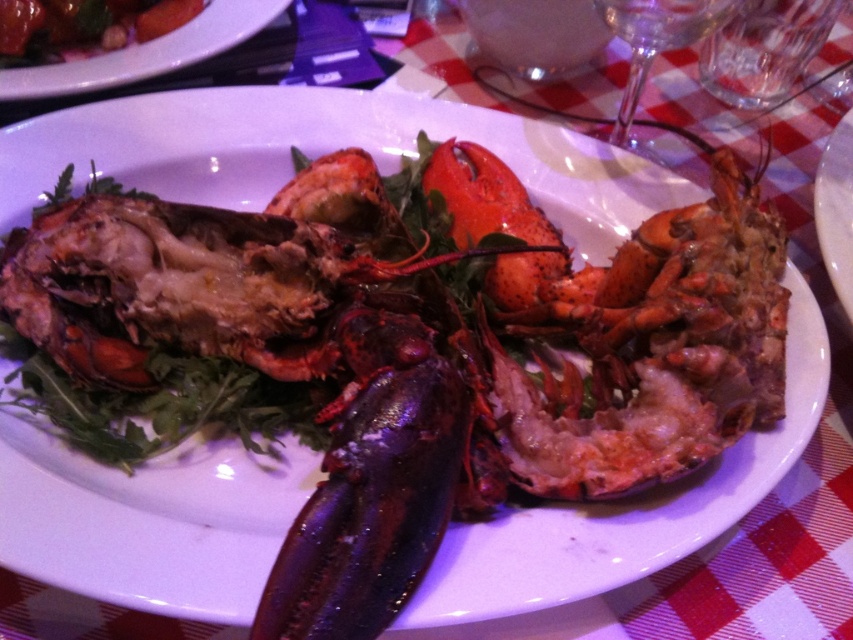
Between matte black lobster at center and matte black lobster at upper left, which one has less height?

matte black lobster at upper left is shorter.

Does point (180, 61) come closer to viewer compared to point (54, 12)?

Yes, it is.

This screenshot has width=853, height=640. Describe the element at coordinates (146, 52) in the screenshot. I see `matte black lobster at center` at that location.

This screenshot has height=640, width=853. Find the location of `matte black lobster at center`. matte black lobster at center is located at coordinates (146, 52).